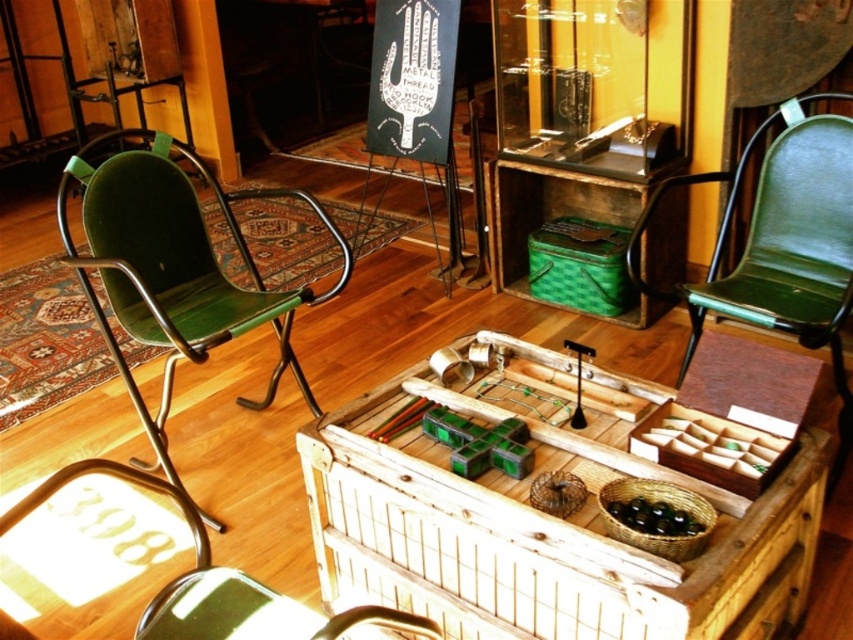
You are sitting in the green leather armchair at right and want to grab the basket from the wooden chest at center. Can you reach it without moving from your seat?

The wooden chest at center is closer to the viewer than the green leather armchair at right, so you can easily reach the basket on the wooden chest at center from your current position in the green leather armchair at right.

You are designing a layout for a small apartment and need to place both the wooden chest at center and the green leather armchair at left. Given their sizes, which one would be more suitable for a narrow hallway?

The wooden chest at center is smaller in size compared to the green leather armchair at left, making it more suitable for a narrow hallway where space is limited.